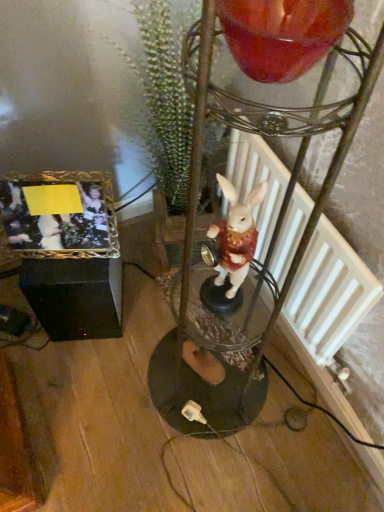
I want to click on gold metallic photo frame at lower left, so point(60,217).

The height and width of the screenshot is (512, 384). What do you see at coordinates (60, 217) in the screenshot?
I see `gold metallic photo frame at lower left` at bounding box center [60, 217].

This screenshot has width=384, height=512. In order to click on shiny glass candle at upper center in this screenshot , I will do `click(282, 34)`.

I want to click on white matte radiator at center-right, so click(329, 293).

Locate an element on the screen. green textured plant at center is located at coordinates (161, 94).

Which object is further away from the camera, green textured plant at center or shiny glass candle at upper center?

green textured plant at center.

From a real-world perspective, is green textured plant at center positioned under shiny glass candle at upper center based on gravity?

Yes, from a real-world perspective, green textured plant at center is below shiny glass candle at upper center.

Is green textured plant at center taller or shorter than shiny glass candle at upper center?

In the image, green textured plant at center appears to be taller than shiny glass candle at upper center.

Considering the relative positions of green textured plant at center and shiny glass candle at upper center in the image provided, is green textured plant at center to the right of shiny glass candle at upper center from the viewer's perspective?

In fact, green textured plant at center is to the left of shiny glass candle at upper center.

In the scene shown: Could you tell me if gold metallic photo frame at lower left is turned towards white porcelain rabbit at center?

No, gold metallic photo frame at lower left is not turned towards white porcelain rabbit at center.

Can you confirm if gold metallic photo frame at lower left is positioned to the right of white porcelain rabbit at center?

Incorrect, gold metallic photo frame at lower left is not on the right side of white porcelain rabbit at center.

Are gold metallic photo frame at lower left and white porcelain rabbit at center located far from each other?

gold metallic photo frame at lower left is near white porcelain rabbit at center, not far away.

How much distance is there between gold metallic photo frame at lower left and white porcelain rabbit at center?

gold metallic photo frame at lower left and white porcelain rabbit at center are 14.59 inches apart from each other.

Is shiny glass candle at upper center positioned beyond the bounds of green textured plant at center?

Yes, shiny glass candle at upper center is not within green textured plant at center.

Could you tell me if shiny glass candle at upper center is facing green textured plant at center?

No, shiny glass candle at upper center is not facing towards green textured plant at center.

Measure the distance from shiny glass candle at upper center to green textured plant at center.

65.07 centimeters.

Which object is further away from the camera, shiny glass candle at upper center or green textured plant at center?

green textured plant at center.

From the image's perspective, is shiny glass candle at upper center on white matte radiator at center-right?

Yes.

Is there a large distance between shiny glass candle at upper center and white matte radiator at center-right?

Actually, shiny glass candle at upper center and white matte radiator at center-right are a little close together.

Is white matte radiator at center-right inside shiny glass candle at upper center?

No.

How different are the orientations of shiny glass candle at upper center and white matte radiator at center-right in degrees?

60.4 degrees separate the facing orientations of shiny glass candle at upper center and white matte radiator at center-right.

Is there a large distance between gold metallic photo frame at lower left and shiny glass candle at upper center?

No, gold metallic photo frame at lower left is in close proximity to shiny glass candle at upper center.

Considering the positions of objects gold metallic photo frame at lower left and shiny glass candle at upper center in the image provided, who is in front, gold metallic photo frame at lower left or shiny glass candle at upper center?

shiny glass candle at upper center.

Is gold metallic photo frame at lower left facing towards shiny glass candle at upper center?

No, gold metallic photo frame at lower left is not aimed at shiny glass candle at upper center.

From the image's perspective, which one is positioned higher, gold metallic photo frame at lower left or shiny glass candle at upper center?

From the image's view, shiny glass candle at upper center is above.

Is white porcelain rabbit at center in contact with shiny glass candle at upper center?

No.

In the image, there is a white porcelain rabbit at center. Where is `candle holder above it (from the image's perspective)`? The height and width of the screenshot is (512, 384). candle holder above it (from the image's perspective) is located at coordinates (282, 34).

From the image's perspective, is white porcelain rabbit at center above or below shiny glass candle at upper center?

white porcelain rabbit at center is situated lower than shiny glass candle at upper center in the image.

Does white porcelain rabbit at center have a lesser width compared to shiny glass candle at upper center?

Yes.

Who is more distant, green textured plant at center or gold metallic photo frame at lower left?

gold metallic photo frame at lower left is behind.

Could you tell me if green textured plant at center is turned towards gold metallic photo frame at lower left?

No.

Where is `plant lying on the right of gold metallic photo frame at lower left`? This screenshot has width=384, height=512. plant lying on the right of gold metallic photo frame at lower left is located at coordinates (161, 94).

From a real-world perspective, is green textured plant at center positioned over gold metallic photo frame at lower left based on gravity?

Yes, from a real-world perspective, green textured plant at center is above gold metallic photo frame at lower left.

I want to click on plant behind the shiny glass candle at upper center, so click(161, 94).

At what (x,y) coordinates should I click in order to perform the action: click on rabbit below the gold metallic photo frame at lower left (from the image's perspective). Please return your answer as a coordinate pair (x, y). The image size is (384, 512). Looking at the image, I should click on (236, 234).

From the image, which object appears to be farther from white porcelain rabbit at center, shiny glass candle at upper center or gold metallic photo frame at lower left?

shiny glass candle at upper center lies further to white porcelain rabbit at center than the other object.

Based on their spatial positions, is green textured plant at center or white porcelain rabbit at center closer to shiny glass candle at upper center?

Based on the image, white porcelain rabbit at center appears to be nearer to shiny glass candle at upper center.

Which object lies nearer to the anchor point white matte radiator at center-right, white porcelain rabbit at center or gold metallic photo frame at lower left?

white porcelain rabbit at center.

Looking at this image, from the image, which object appears to be farther from shiny glass candle at upper center, white porcelain rabbit at center or green textured plant at center?

The object further to shiny glass candle at upper center is green textured plant at center.

When comparing their distances from shiny glass candle at upper center, does white matte radiator at center-right or white porcelain rabbit at center seem closer?

white porcelain rabbit at center is positioned closer to the anchor shiny glass candle at upper center.

Which object lies further to the anchor point green textured plant at center, shiny glass candle at upper center or white porcelain rabbit at center?

shiny glass candle at upper center lies further to green textured plant at center than the other object.

Looking at the image, which one is located further to gold metallic photo frame at lower left, green textured plant at center or white matte radiator at center-right?

Among the two, white matte radiator at center-right is located further to gold metallic photo frame at lower left.

Which object lies further to the anchor point green textured plant at center, gold metallic photo frame at lower left or white matte radiator at center-right?

Among the two, gold metallic photo frame at lower left is located further to green textured plant at center.

Find the location of a particular element. The height and width of the screenshot is (512, 384). rabbit between gold metallic photo frame at lower left and white matte radiator at center-right from left to right is located at coordinates (236, 234).

Find the location of a particular element. plant positioned between shiny glass candle at upper center and white matte radiator at center-right from near to far is located at coordinates (161, 94).

At what (x,y) coordinates should I click in order to perform the action: click on plant between gold metallic photo frame at lower left and white porcelain rabbit at center in the horizontal direction. Please return your answer as a coordinate pair (x, y). This screenshot has height=512, width=384. Looking at the image, I should click on (161, 94).

The height and width of the screenshot is (512, 384). Find the location of `plant situated between gold metallic photo frame at lower left and white matte radiator at center-right from left to right`. plant situated between gold metallic photo frame at lower left and white matte radiator at center-right from left to right is located at coordinates (161, 94).